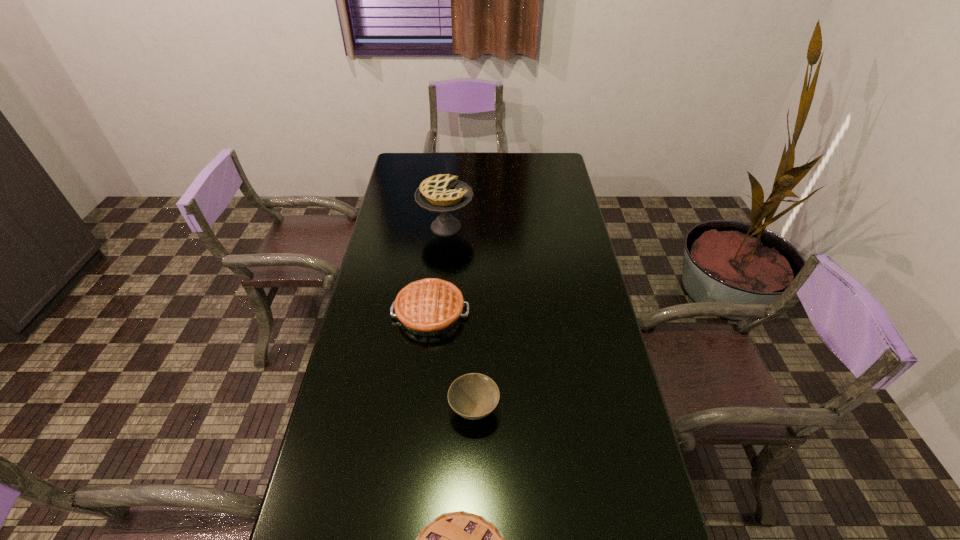
Where is `the tallest object`? This screenshot has height=540, width=960. the tallest object is located at coordinates (443, 193).

Locate an element on the screen. Image resolution: width=960 pixels, height=540 pixels. the farthest pie is located at coordinates 443,193.

Locate an element on the screen. the second shortest pie is located at coordinates [x=428, y=307].

Identify the location of the second farthest pie. This screenshot has width=960, height=540. (428, 307).

Image resolution: width=960 pixels, height=540 pixels. Identify the location of the second nearest object. (473, 396).

Locate an element on the screen. vacant space located 0.270m on the cut side of the farthest pie is located at coordinates (542, 227).

This screenshot has width=960, height=540. I want to click on vacant region located on the front of the second farthest object, so click(420, 411).

Where is `free location located 0.050m on the front of the bowl`? This screenshot has width=960, height=540. free location located 0.050m on the front of the bowl is located at coordinates (473, 452).

Where is `vacant point at the far edge`? This screenshot has width=960, height=540. vacant point at the far edge is located at coordinates (448, 154).

Identify the location of vacant region at the left edge of the desktop. (370, 339).